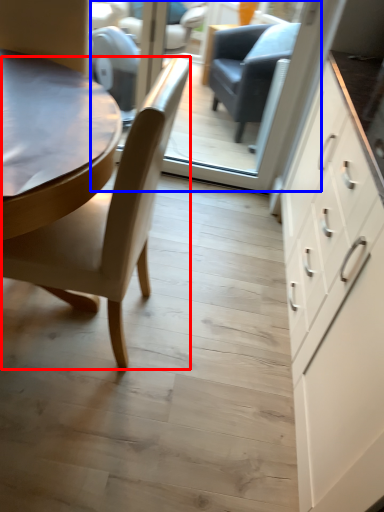
Question: Which of the following is the farthest to the observer, chair (highlighted by a red box) or glass door (highlighted by a blue box)?

Choices:
 (A) chair
 (B) glass door

Answer: (B)